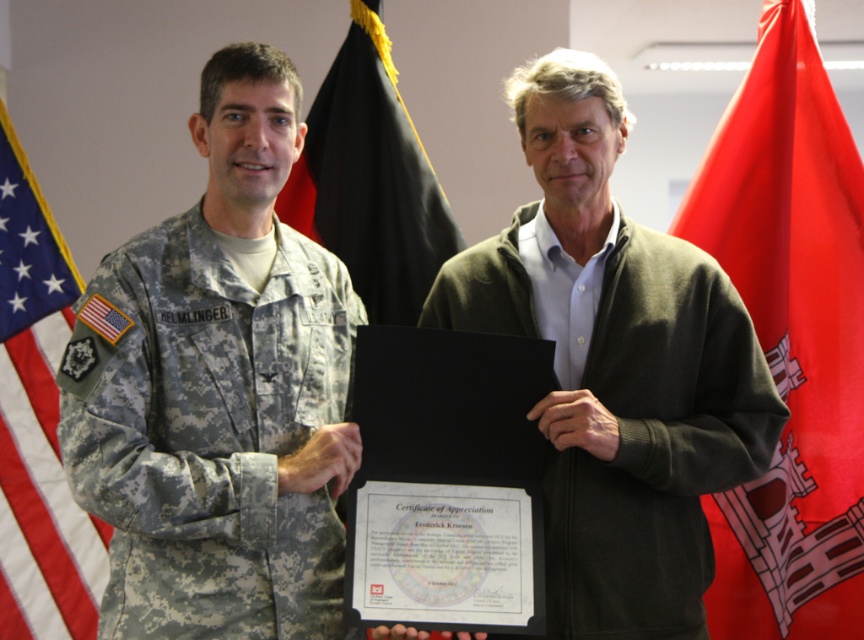
Is point (221, 468) in front of point (10, 518)?

Yes, point (221, 468) is in front of point (10, 518).

Is camouflage fabric uniform at left thinner than american flag at left?

In fact, camouflage fabric uniform at left might be wider than american flag at left.

Between point (226, 634) and point (91, 621), which one is positioned behind?

The point (91, 621) is more distant.

Locate an element on the screen. camouflage fabric uniform at left is located at coordinates (208, 433).

Who is lower down, red fabric flag at right or green matte sweater at center?

green matte sweater at center is lower down.

This screenshot has width=864, height=640. Find the location of `red fabric flag at right`. red fabric flag at right is located at coordinates (791, 337).

Measure the distance between red fabric flag at right and american flag at left.

They are 5.34 feet apart.

Between red fabric flag at right and american flag at left, which one is positioned higher?

Positioned higher is red fabric flag at right.

This screenshot has height=640, width=864. In order to click on red fabric flag at right in this screenshot , I will do `click(791, 337)`.